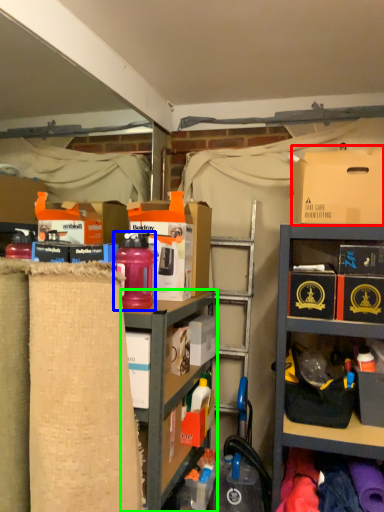
Question: Based on their relative distances, which object is nearer to cardboard box (highlighted by a red box)? Choose from bottle (highlighted by a blue box) and shelf (highlighted by a green box).

Choices:
 (A) bottle
 (B) shelf

Answer: (A)